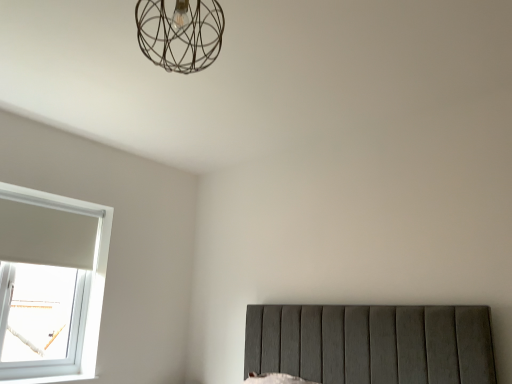
At what (x,y) coordinates should I click in order to perform the action: click on transparent glass window at lower left. Please return your answer as a coordinate pair (x, y). Image resolution: width=512 pixels, height=384 pixels. Looking at the image, I should click on (39, 313).

This screenshot has width=512, height=384. What do you see at coordinates (39, 313) in the screenshot? I see `transparent glass window at lower left` at bounding box center [39, 313].

This screenshot has height=384, width=512. What do you see at coordinates (180, 34) in the screenshot? I see `metallic wire cage at upper center` at bounding box center [180, 34].

What is the approximate width of metallic wire cage at upper center?

The width of metallic wire cage at upper center is 12.85 inches.

Locate an element on the screen. This screenshot has height=384, width=512. metallic wire cage at upper center is located at coordinates (180, 34).

Image resolution: width=512 pixels, height=384 pixels. I want to click on transparent glass window at lower left, so click(39, 313).

Can you confirm if transparent glass window at lower left is positioned to the right of metallic wire cage at upper center?

No, transparent glass window at lower left is not to the right of metallic wire cage at upper center.

Relative to metallic wire cage at upper center, is transparent glass window at lower left in front or behind?

Visually, transparent glass window at lower left is located behind metallic wire cage at upper center.

Does point (34, 325) come closer to viewer compared to point (147, 44)?

No.

From the image's perspective, is transparent glass window at lower left above or below metallic wire cage at upper center?

transparent glass window at lower left is situated lower than metallic wire cage at upper center in the image.

From a real-world perspective, who is located higher, transparent glass window at lower left or metallic wire cage at upper center?

metallic wire cage at upper center, from a real-world perspective.

Which of these two, transparent glass window at lower left or metallic wire cage at upper center, is thinner?

With smaller width is transparent glass window at lower left.

Considering the relative sizes of transparent glass window at lower left and metallic wire cage at upper center in the image provided, is transparent glass window at lower left shorter than metallic wire cage at upper center?

Incorrect, the height of transparent glass window at lower left does not fall short of that of metallic wire cage at upper center.

Looking at this image, is transparent glass window at lower left bigger than metallic wire cage at upper center?

Yes.

Is transparent glass window at lower left outside of metallic wire cage at upper center?

Yes, transparent glass window at lower left is not within metallic wire cage at upper center.

Is transparent glass window at lower left with metallic wire cage at upper center?

No.

Does transparent glass window at lower left turn towards metallic wire cage at upper center?

Yes, transparent glass window at lower left faces towards metallic wire cage at upper center.

How much distance is there between transparent glass window at lower left and metallic wire cage at upper center?

They are 1.91 meters apart.

You are a GUI agent. You are given a task and a screenshot of the screen. Output one action in this format:
    pyautogui.click(x=<x>, y=<y>)
    Task: Click on the lamp above the transparent glass window at lower left (from the image's perspective)
    This screenshot has width=512, height=384.
    Given the screenshot: What is the action you would take?
    pyautogui.click(x=180, y=34)

Which object is positioned more to the right, metallic wire cage at upper center or transparent glass window at lower left?

From the viewer's perspective, metallic wire cage at upper center appears more on the right side.

In the image, is metallic wire cage at upper center positioned in front of or behind transparent glass window at lower left?

Clearly, metallic wire cage at upper center is in front of transparent glass window at lower left.

Considering the positions of points (164, 53) and (50, 337), is point (164, 53) closer to camera compared to point (50, 337)?

Yes.

From the image's perspective, between metallic wire cage at upper center and transparent glass window at lower left, who is located below?

From the image's view, transparent glass window at lower left is below.

From a real-world perspective, between metallic wire cage at upper center and transparent glass window at lower left, who is vertically higher?

metallic wire cage at upper center.

Between metallic wire cage at upper center and transparent glass window at lower left, which one has smaller width?

transparent glass window at lower left is thinner.

Is metallic wire cage at upper center shorter than transparent glass window at lower left?

Yes.

Which of these two, metallic wire cage at upper center or transparent glass window at lower left, is bigger?

transparent glass window at lower left is bigger.

Based on the photo, is metallic wire cage at upper center located outside transparent glass window at lower left?

That's correct, metallic wire cage at upper center is outside of transparent glass window at lower left.

Is there a large distance between metallic wire cage at upper center and transparent glass window at lower left?

metallic wire cage at upper center is far away from transparent glass window at lower left.

Is metallic wire cage at upper center turned away from transparent glass window at lower left?

metallic wire cage at upper center does not have its back to transparent glass window at lower left.

Can you tell me how much metallic wire cage at upper center and transparent glass window at lower left differ in facing direction?

The angle between the facing direction of metallic wire cage at upper center and the facing direction of transparent glass window at lower left is 89.2 degrees.

How far apart are metallic wire cage at upper center and transparent glass window at lower left?

A distance of 1.91 meters exists between metallic wire cage at upper center and transparent glass window at lower left.

This screenshot has height=384, width=512. In order to click on window screen located behind the metallic wire cage at upper center in this screenshot , I will do `click(39, 313)`.

Where is `lamp on the right of transparent glass window at lower left`? lamp on the right of transparent glass window at lower left is located at coordinates (180, 34).

Locate an element on the screen. window screen located on the left of metallic wire cage at upper center is located at coordinates (39, 313).